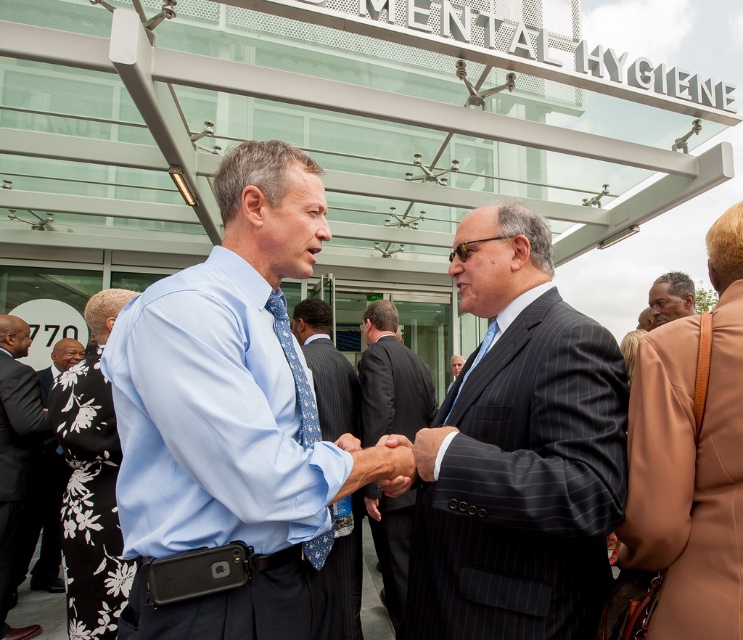
Question: Among these objects, which one is farthest from the camera?

Choices:
 (A) dark blue suit at center
 (B) blue patterned tie at center
 (C) dark suit at lower left
 (D) light blue shirt at center

Answer: (A)

Question: Observing the image, what is the correct spatial positioning of dark suit at lower left in reference to blue patterned tie at center?

Choices:
 (A) below
 (B) above

Answer: (A)

Question: Estimate the real-world distances between objects in this image. Which object is closer to the dark gray pinstripe suit at center?

Choices:
 (A) light blue shirt at center
 (B) blue patterned tie at center
 (C) dark suit at lower left
 (D) dark brown leather jacket at right

Answer: (A)

Question: Does light blue shirt at center have a greater width compared to black floral dress at lower left?

Choices:
 (A) yes
 (B) no

Answer: (B)

Question: Is dark gray pinstripe suit at center closer to the viewer compared to dark suit at lower left?

Choices:
 (A) no
 (B) yes

Answer: (B)

Question: Which point is farther to the camera?

Choices:
 (A) dark gray pinstripe suit at center
 (B) dark suit at lower left

Answer: (B)